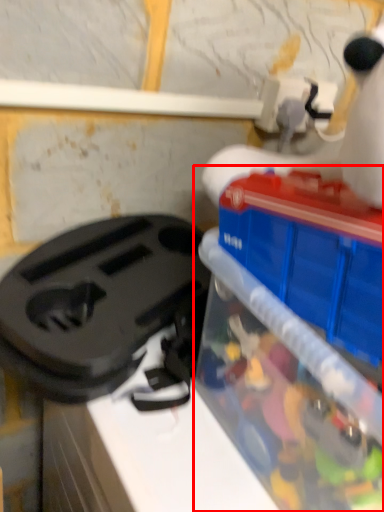
Question: From the image's perspective, what is the correct spatial relationship of toy (annotated by the red box) in relation to appliance?

Choices:
 (A) below
 (B) above

Answer: (A)